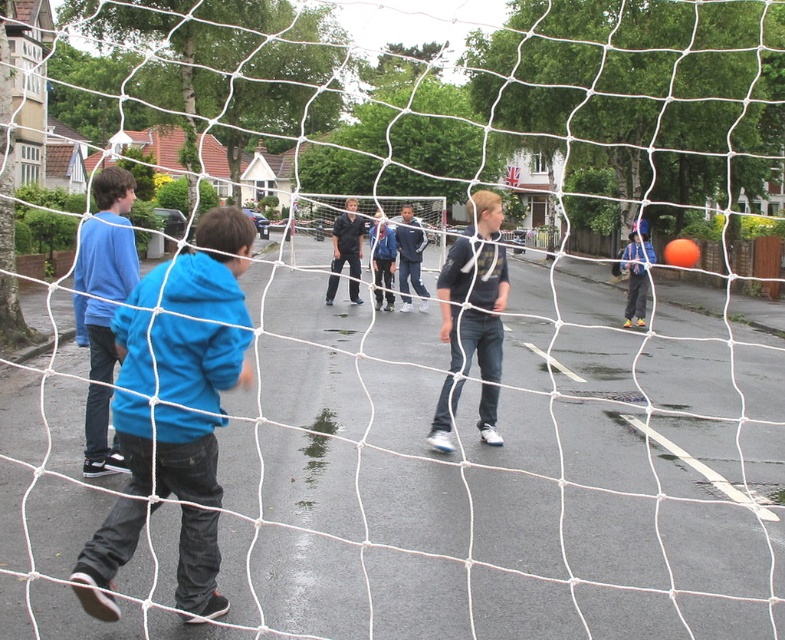
Is blue fleece jacket at left positioned before dark blue t-shirt at center?

Yes, blue fleece jacket at left is in front of dark blue t-shirt at center.

Where is `blue fleece jacket at left`? The width and height of the screenshot is (785, 640). blue fleece jacket at left is located at coordinates (183, 362).

In the scene shown: Can you confirm if dark blue t-shirt at center is positioned above matte blue hoodie at left?

Actually, dark blue t-shirt at center is below matte blue hoodie at left.

Does point (477, 289) come behind point (119, 177)?

Yes, it is.

Does point (493, 280) come farther from viewer compared to point (88, 339)?

Yes, point (493, 280) is behind point (88, 339).

Identify the location of dark blue t-shirt at center. (473, 317).

In the scene shown: Is blue fleece jacket at left to the right of matte blue hoodie at left from the viewer's perspective?

Indeed, blue fleece jacket at left is positioned on the right side of matte blue hoodie at left.

This screenshot has height=640, width=785. What do you see at coordinates (183, 362) in the screenshot?
I see `blue fleece jacket at left` at bounding box center [183, 362].

The image size is (785, 640). In order to click on blue fleece jacket at left in this screenshot , I will do `click(183, 362)`.